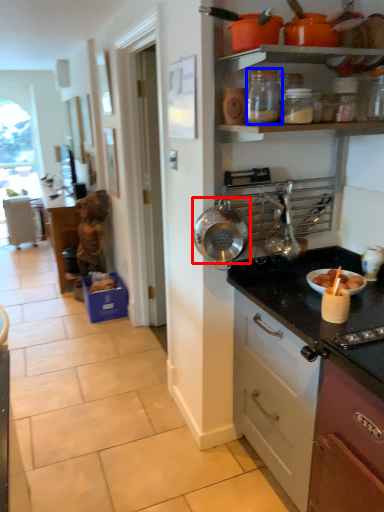
Question: Which of the following is the farthest to the observer, kitchen appliance (highlighted by a red box) or kitchen appliance (highlighted by a blue box)?

Choices:
 (A) kitchen appliance
 (B) kitchen appliance

Answer: (A)